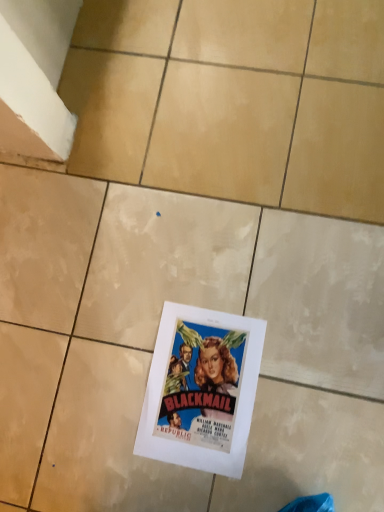
You are a GUI agent. You are given a task and a screenshot of the screen. Output one action in this format:
    pyautogui.click(x=<x>, y=<y>)
    Task: Click on the free space behind matte paper poster at center
    Image resolution: width=384 pixels, height=512 pixels.
    Given the screenshot: What is the action you would take?
    pyautogui.click(x=155, y=285)